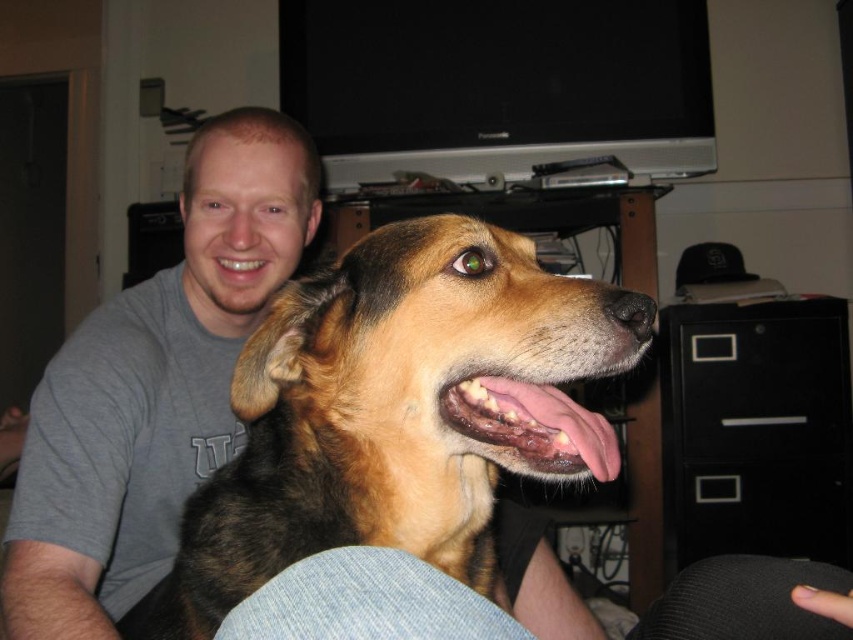
You are taking a photo of the dog and the person in this scene. You notice two points marked in the image. One is at coordinates point (444, 392) and the other at point (251, 275). Which point is closer to the camera?

Point (444, 392) is closer to the camera than point (251, 275).

Based on the photo, you are trying to decide which item to pick up first. The brown fur dog at center and the gray cotton shirt at upper left are both in your view. Based on their sizes, which one should you choose to pick up first?

The brown fur dog at center is larger in size than the gray cotton shirt at upper left, so you should pick up the gray cotton shirt at upper left first since it is smaller and easier to handle.